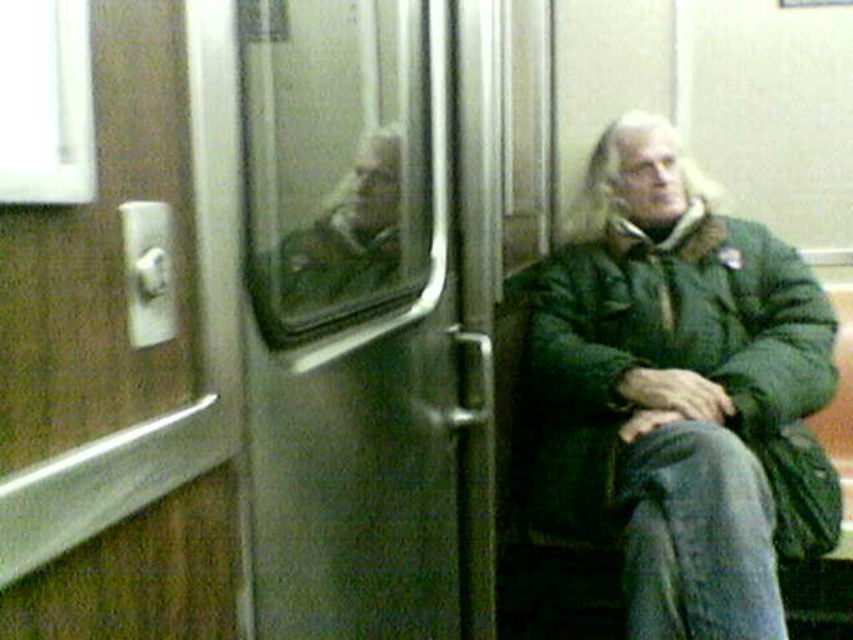
Question: Which object appears farthest from the camera in this image?

Choices:
 (A) green fuzzy jacket at right
 (B) green fabric jacket at center

Answer: (A)

Question: Can you confirm if green fuzzy jacket at right is positioned below green fabric jacket at center?

Choices:
 (A) yes
 (B) no

Answer: (A)

Question: Which point is farther to the camera?

Choices:
 (A) green fuzzy jacket at right
 (B) green fabric jacket at center

Answer: (A)

Question: Is green fuzzy jacket at right bigger than green fabric jacket at center?

Choices:
 (A) no
 (B) yes

Answer: (B)

Question: Considering the relative positions of green fuzzy jacket at right and green fabric jacket at center in the image provided, where is green fuzzy jacket at right located with respect to green fabric jacket at center?

Choices:
 (A) right
 (B) left

Answer: (A)